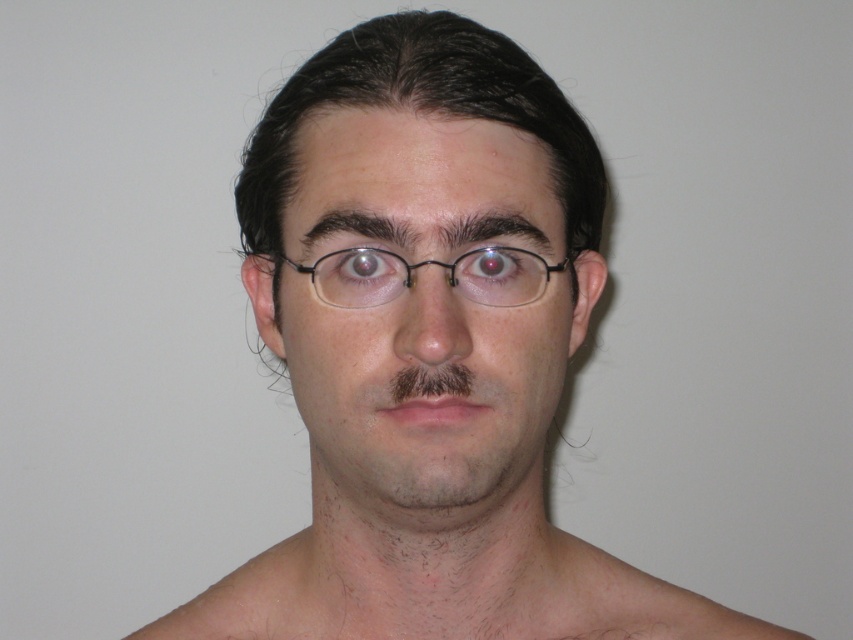
Between point (503, 129) and point (521, 256), which one is positioned behind?

Positioned behind is point (521, 256).

Which is in front, point (486, 435) or point (479, 260)?

Point (486, 435)

Which is in front, point (480, 214) or point (456, 268)?

Point (480, 214) is more forward.

Locate an element on the screen. smooth skin face at center is located at coordinates (422, 308).

Who is positioned more to the right, smooth skin face at center or glossy white eye at upper center?

Positioned to the right is smooth skin face at center.

Describe the element at coordinates (422, 308) in the screenshot. This screenshot has height=640, width=853. I see `smooth skin face at center` at that location.

I want to click on smooth skin face at center, so click(x=422, y=308).

Does point (465, 292) come farther from viewer compared to point (376, 269)?

No, (465, 292) is closer to viewer.

Does glossy red eye at center appear over glossy white eye at upper center?

Actually, glossy red eye at center is below glossy white eye at upper center.

Which is in front, point (480, 268) or point (360, 273)?

Point (360, 273) is in front.

This screenshot has width=853, height=640. Identify the location of glossy red eye at center. 495,273.